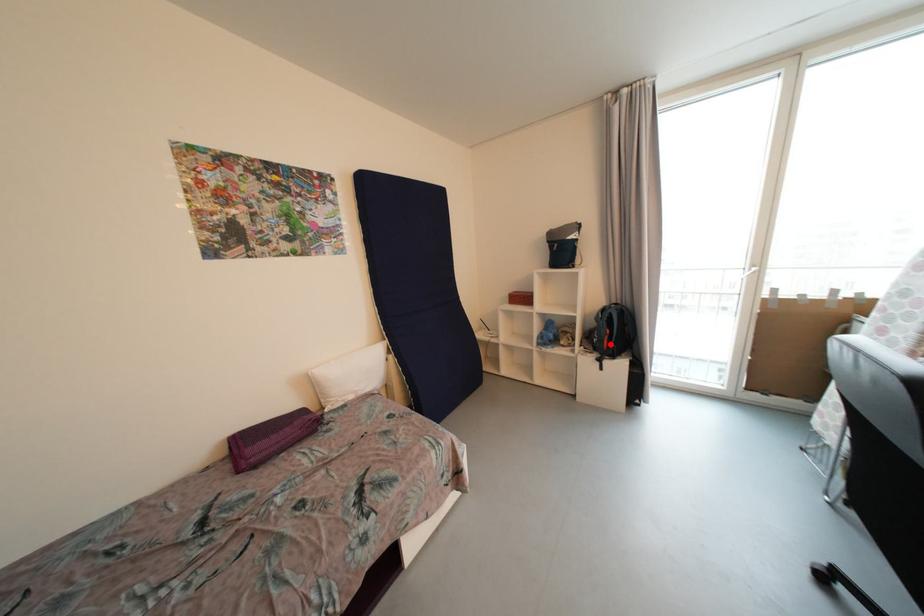
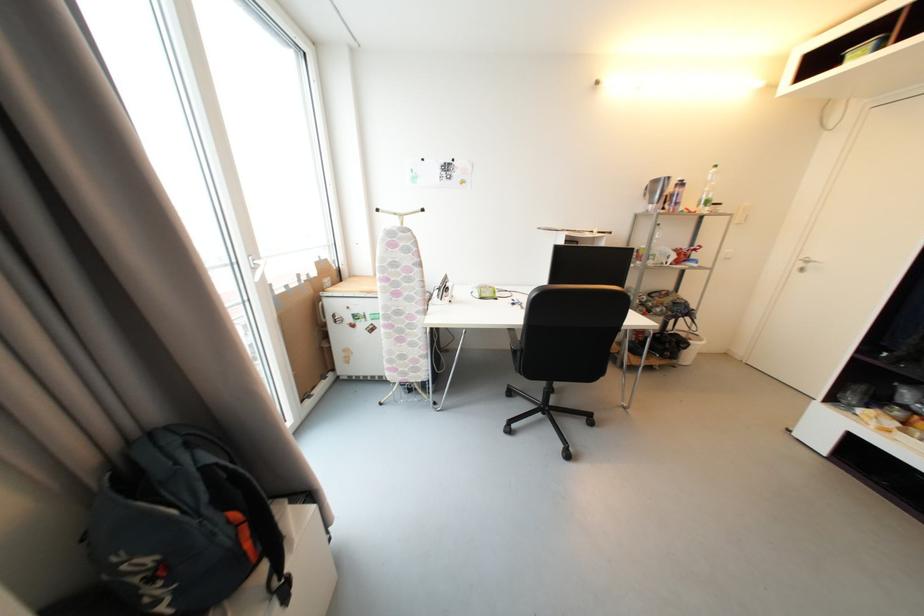
Where in the second image is the point corresponding to the highlighted location from the first image?

(253, 546)